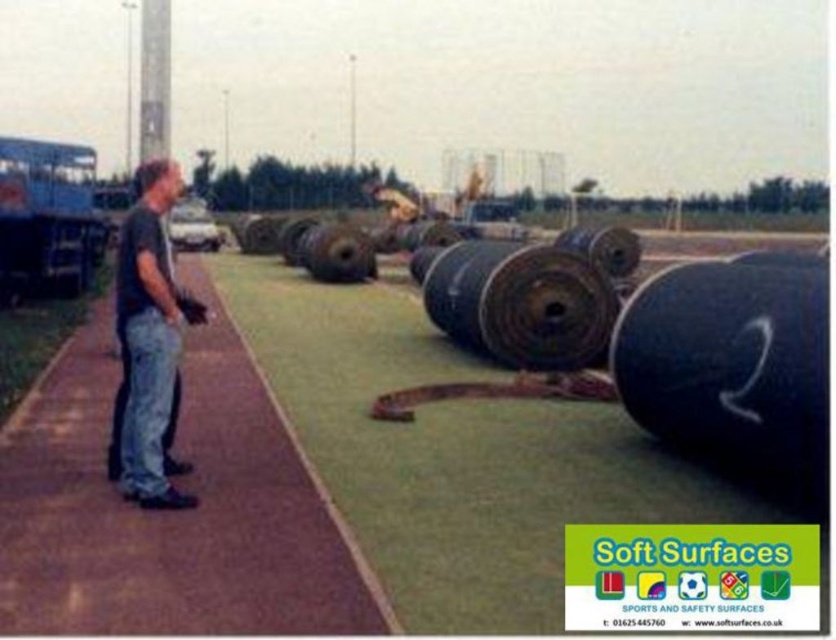
Question: Estimate the real-world distances between objects in this image. Which object is farther from the black rubber tire at center?

Choices:
 (A) blue metallic trailer truck at left
 (B) brown rubber path at center
 (C) dark blue t-shirt at left

Answer: (C)

Question: Is dark blue t-shirt at left positioned behind black rubber tire at center?

Choices:
 (A) no
 (B) yes

Answer: (A)

Question: Estimate the real-world distances between objects in this image. Which object is farther from the blue metallic trailer truck at left?

Choices:
 (A) black rubber tire at center
 (B) brown rubber path at center
 (C) dark blue t-shirt at left

Answer: (C)

Question: Can you confirm if dark blue t-shirt at left is smaller than blue metallic trailer truck at left?

Choices:
 (A) yes
 (B) no

Answer: (A)

Question: Does brown rubber path at center have a larger size compared to dark blue t-shirt at left?

Choices:
 (A) no
 (B) yes

Answer: (B)

Question: Which of the following is the closest to the observer?

Choices:
 (A) black rubber tire at center
 (B) dark blue t-shirt at left
 (C) brown rubber path at center
 (D) blue metallic trailer truck at left

Answer: (C)